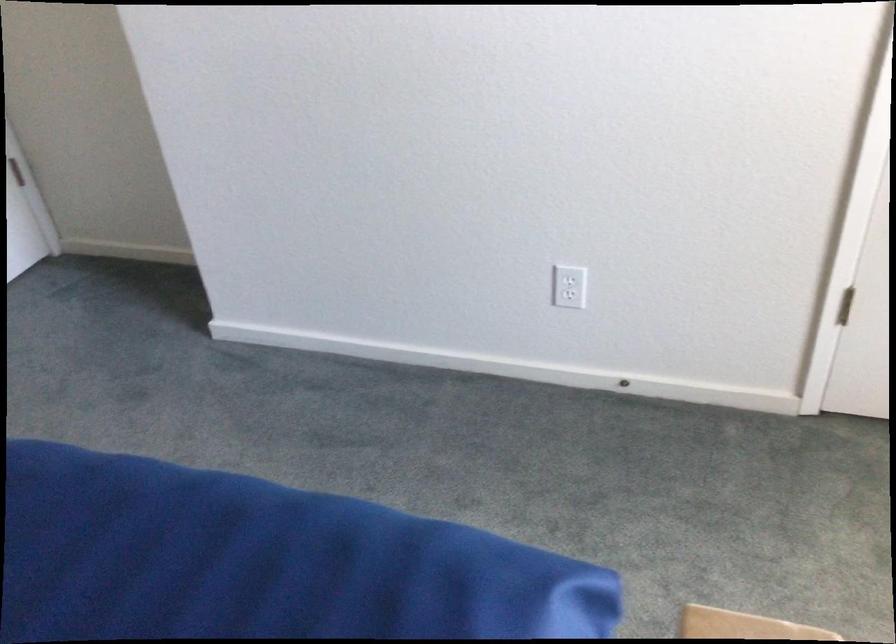
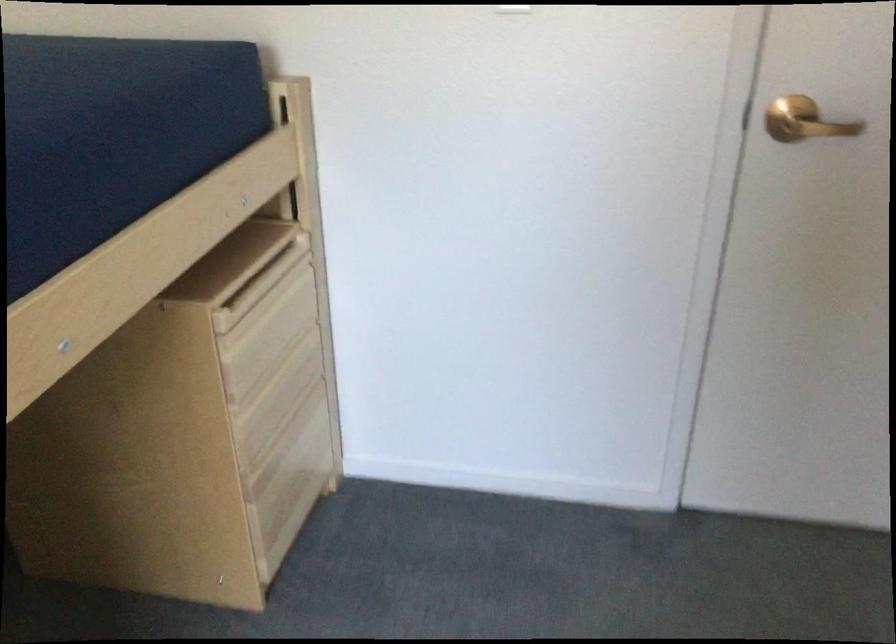
The first image is from the beginning of the video and the second image is from the end. How did the camera likely rotate when shooting the video?

The camera's rotation is toward left-down.